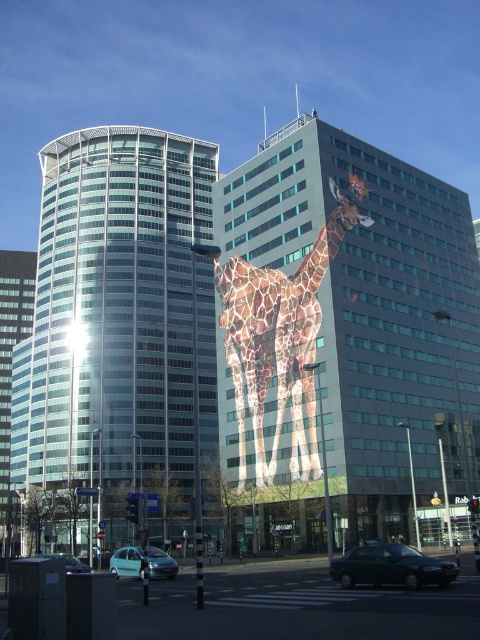
Question: Which point appears closest to the camera in this image?

Choices:
 (A) (312, 449)
 (B) (19, 288)

Answer: (A)

Question: Is metallic dark green car at lower center above light blue matte car at lower left?

Choices:
 (A) no
 (B) yes

Answer: (B)

Question: Among these points, which one is nearest to the camera?

Choices:
 (A) (43, 556)
 (B) (177, 566)

Answer: (B)

Question: Can you confirm if light blue matte car at lower left is bigger than teal matte car at lower left?

Choices:
 (A) yes
 (B) no

Answer: (B)

Question: Which object appears farthest from the camera in this image?

Choices:
 (A) glassy silver tower at center
 (B) matte glass building at center
 (C) glassy modern skyscraper at left
 (D) spotted fur giraffe at center

Answer: (C)

Question: Can you confirm if glassy silver tower at center is positioned to the left of teal matte car at lower left?

Choices:
 (A) no
 (B) yes

Answer: (B)